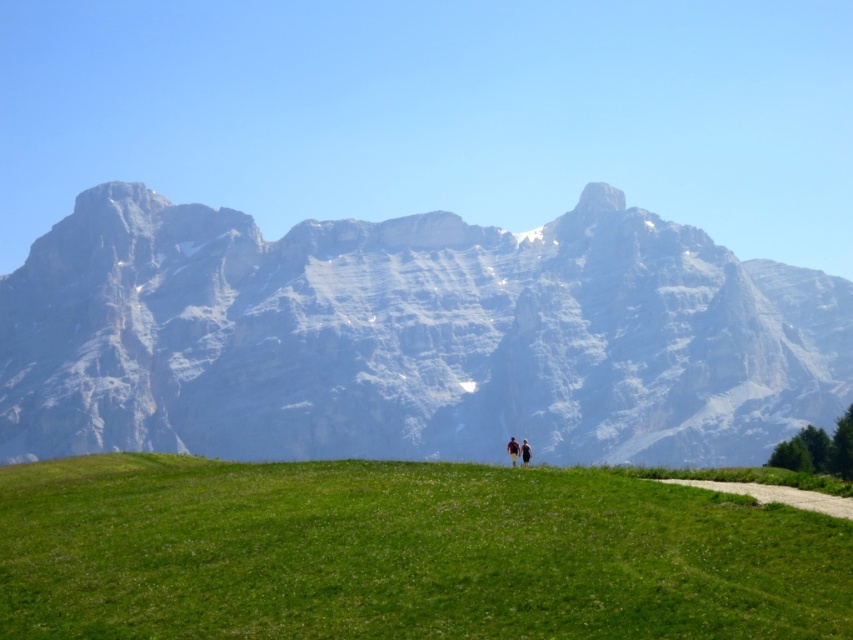
You are a photographer planning to capture a wide shot of the scene. You want to ensure both the red fabric couple at center and the dark brown leather jacket at center are clearly visible. Which object will appear wider in the photo?

The red fabric couple at center will appear wider in the photo because its width surpasses that of the dark brown leather jacket at center.

You are standing at the starting point of the path in the meadow. You want to reach the base of the mountain where the path ends. Which of the two points, point (73,422) or point (524,442), is closer to your current position?

Point (73,422) is closer to your current position because it is further to the viewer than point (524,442), meaning it is nearer to you.